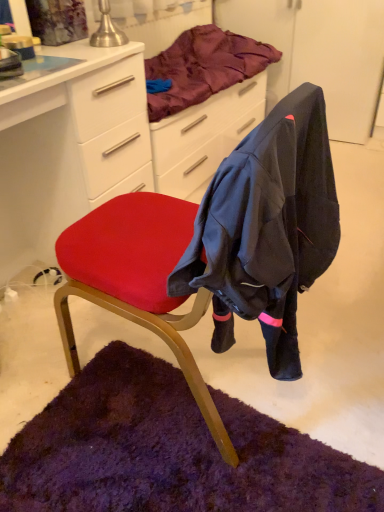
Question: Is matte white desk at center positioned with its back to satin purple blanket at upper center?

Choices:
 (A) yes
 (B) no

Answer: (B)

Question: Is there a large distance between matte white desk at center and satin purple blanket at upper center?

Choices:
 (A) yes
 (B) no

Answer: (B)

Question: From a real-world perspective, is matte white desk at center positioned over satin purple blanket at upper center based on gravity?

Choices:
 (A) yes
 (B) no

Answer: (B)

Question: Does matte white desk at center appear on the right side of satin purple blanket at upper center?

Choices:
 (A) yes
 (B) no

Answer: (B)

Question: Can you confirm if matte white desk at center is taller than satin purple blanket at upper center?

Choices:
 (A) yes
 (B) no

Answer: (A)

Question: Does matte white desk at center have a larger size compared to satin purple blanket at upper center?

Choices:
 (A) yes
 (B) no

Answer: (A)

Question: From a real-world perspective, does satin purple blanket at upper center sit lower than matte white desk at center?

Choices:
 (A) yes
 (B) no

Answer: (B)

Question: Is satin purple blanket at upper center not inside matte white desk at center?

Choices:
 (A) yes
 (B) no

Answer: (A)

Question: Does satin purple blanket at upper center have a lesser height compared to matte white desk at center?

Choices:
 (A) no
 (B) yes

Answer: (B)

Question: Does satin purple blanket at upper center turn towards matte white desk at center?

Choices:
 (A) yes
 (B) no

Answer: (B)

Question: Considering the relative positions of satin purple blanket at upper center and matte white desk at center in the image provided, is satin purple blanket at upper center to the right of matte white desk at center from the viewer's perspective?

Choices:
 (A) yes
 (B) no

Answer: (A)

Question: Can you confirm if satin purple blanket at upper center is thinner than matte white desk at center?

Choices:
 (A) yes
 (B) no

Answer: (A)

Question: Is satin purple blanket at upper center thinner than velvet red chair at center?

Choices:
 (A) no
 (B) yes

Answer: (B)